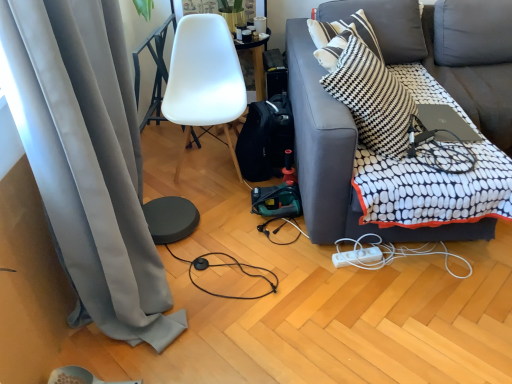
What is the approximate height of white matte chair at center?

The height of white matte chair at center is 33.79 inches.

At what (x,y) coordinates should I click in order to perform the action: click on white plastic power strip at lower right. Please return your answer as a coordinate pair (x, y). This screenshot has width=512, height=384. Looking at the image, I should click on (388, 254).

Where is `white plastic power outlet at lower center`? white plastic power outlet at lower center is located at coordinates (357, 257).

Is black and white checkered pillow at upper right surrounding black fabric backpack at center?

No, black fabric backpack at center is not a part of black and white checkered pillow at upper right.

Which object is closer to the camera, black and white checkered pillow at upper right or black fabric backpack at center?

Positioned in front is black and white checkered pillow at upper right.

How many degrees apart are the facing directions of black and white checkered pillow at upper right and black fabric backpack at center?

The angular difference between black and white checkered pillow at upper right and black fabric backpack at center is 60.8 degrees.

In terms of width, does white matte chair at center look wider or thinner when compared to black cable at lower center?

white matte chair at center is wider than black cable at lower center.

From the image's perspective, is white matte chair at center located above or below black cable at lower center?

Based on their image positions, white matte chair at center is located above black cable at lower center.

Which is in front, white matte chair at center or black cable at lower center?

black cable at lower center is more forward.

Which point is more forward, (x=227, y=103) or (x=204, y=290)?

The point (x=204, y=290) is more forward.

Is white matte chair at center completely or partially outside of white plastic power strip at lower right?

That's correct, white matte chair at center is outside of white plastic power strip at lower right.

Could you tell me if white matte chair at center is facing white plastic power strip at lower right?

No, white matte chair at center does not turn towards white plastic power strip at lower right.

From a real-world perspective, who is located lower, white matte chair at center or white plastic power strip at lower right?

In real-world perspective, white plastic power strip at lower right is lower.

Considering their positions, is white plastic power strip at lower right located in front of or behind silver metallic laptop at upper right?

In the image, white plastic power strip at lower right appears in front of silver metallic laptop at upper right.

Is white plastic power strip at lower right taller or shorter than silver metallic laptop at upper right?

In the image, white plastic power strip at lower right appears to be taller than silver metallic laptop at upper right.

Is silver metallic laptop at upper right completely or partially inside white plastic power strip at lower right?

Actually, silver metallic laptop at upper right is outside white plastic power strip at lower right.

How many degrees apart are the facing directions of white plastic power strip at lower right and silver metallic laptop at upper right?

They differ by 176 degrees in their facing directions.

From a real-world perspective, between black cable at lower center and dark gray fabric couch at right, who is vertically lower?

black cable at lower center, from a real-world perspective.

In the image, is black cable at lower center on the left side or the right side of dark gray fabric couch at right?

black cable at lower center is to the left of dark gray fabric couch at right.

Does black cable at lower center have a greater height compared to dark gray fabric couch at right?

No.

Does black cable at lower center have a larger size compared to dark gray fabric couch at right?

No, black cable at lower center is not bigger than dark gray fabric couch at right.

Is silver metallic laptop at upper right facing away from black and white checkered pillow at upper right?

silver metallic laptop at upper right is not turned away from black and white checkered pillow at upper right.

From the image's perspective, is silver metallic laptop at upper right under black and white checkered pillow at upper right?

Indeed, from the image's perspective, silver metallic laptop at upper right is shown beneath black and white checkered pillow at upper right.

Where is `laptop beneath the black and white checkered pillow at upper right (from a real-world perspective)`? laptop beneath the black and white checkered pillow at upper right (from a real-world perspective) is located at coordinates pyautogui.click(x=445, y=121).

In terms of height, does silver metallic laptop at upper right look taller or shorter compared to black and white checkered pillow at upper right?

Clearly, silver metallic laptop at upper right is shorter compared to black and white checkered pillow at upper right.

Is black cable at lower center outside of white plastic power strip at lower right?

That's correct, black cable at lower center is outside of white plastic power strip at lower right.

Is black cable at lower center far away from white plastic power strip at lower right?

No, there isn't a large distance between black cable at lower center and white plastic power strip at lower right.

From the picture: Considering the relative sizes of black cable at lower center and white plastic power strip at lower right in the image provided, is black cable at lower center bigger than white plastic power strip at lower right?

No.

In the scene shown: From a real-world perspective, which object stands above the other?

white plastic power strip at lower right is physically above.

Locate an element on the screen. The height and width of the screenshot is (384, 512). backpack behind the black and white checkered pillow at upper right is located at coordinates (265, 138).

You are a GUI agent. You are given a task and a screenshot of the screen. Output one action in this format:
    pyautogui.click(x=<x>, y=<y>)
    Task: Click on the chair on the left of the black cable at lower center
    This screenshot has height=384, width=512.
    Given the screenshot: What is the action you would take?
    pyautogui.click(x=204, y=80)

Based on their spatial positions, is dark gray fabric couch at right or black and white checkered pillow at upper right further from silver metallic laptop at upper right?

The object further to silver metallic laptop at upper right is dark gray fabric couch at right.

Looking at the image, which one is located further to white matte chair at center, black and white checkered pillow at upper right or gray fabric curtain at left?

gray fabric curtain at left.

When comparing their distances from black fabric backpack at center, does white matte chair at center or black and white checkered pillow at upper right seem closer?

Based on the image, white matte chair at center appears to be nearer to black fabric backpack at center.

Considering their positions, is black and white checkered pillow at upper right positioned further to gray fabric curtain at left than dark gray fabric couch at right?

The object further to gray fabric curtain at left is black and white checkered pillow at upper right.

Looking at the image, which one is located further to black and white checkered pillow at upper right, black cable at lower center or white plastic power strip at lower right?

black cable at lower center.

From the picture: Which object lies further to the anchor point white plastic power outlet at lower center, silver metallic laptop at upper right or black fabric backpack at center?

black fabric backpack at center is further to white plastic power outlet at lower center.

Which object lies nearer to the anchor point white plastic power strip at lower right, white matte chair at center or silver metallic laptop at upper right?

Based on the image, silver metallic laptop at upper right appears to be nearer to white plastic power strip at lower right.

Estimate the real-world distances between objects in this image. Which object is closer to gray fabric curtain at left, silver metallic laptop at upper right or white plastic power outlet at lower center?

white plastic power outlet at lower center.

Find the location of a particular element. power outlet between gray fabric curtain at left and black fabric backpack at center along the z-axis is located at coordinates (357, 257).

You are a GUI agent. You are given a task and a screenshot of the screen. Output one action in this format:
    pyautogui.click(x=<x>, y=<y>)
    Task: Click on the power outlet situated between white matte chair at center and silver metallic laptop at upper right from left to right
    The width and height of the screenshot is (512, 384).
    Given the screenshot: What is the action you would take?
    pyautogui.click(x=357, y=257)

This screenshot has width=512, height=384. Find the location of `wire between white matte chair at center and dark gray fabric couch at right`. wire between white matte chair at center and dark gray fabric couch at right is located at coordinates (226, 265).

I want to click on laptop between black and white checkered pillow at upper right and dark gray fabric couch at right from left to right, so point(445,121).